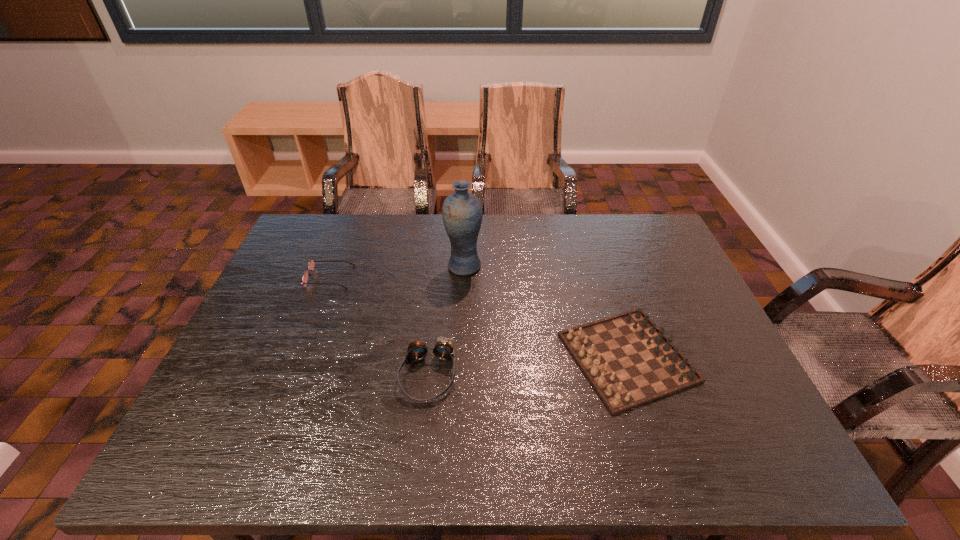
Image resolution: width=960 pixels, height=540 pixels. In order to click on object situated at the left edge in this screenshot , I will do `click(311, 264)`.

The image size is (960, 540). Find the location of `object situated at the right edge`. object situated at the right edge is located at coordinates (629, 361).

The width and height of the screenshot is (960, 540). I want to click on vacant space at the far edge, so click(403, 234).

At what (x,y) coordinates should I click in order to perform the action: click on vacant space at the near edge of the desktop. Please return your answer as a coordinate pair (x, y). Looking at the image, I should click on (409, 453).

Locate an element on the screen. vacant space at the left edge of the desktop is located at coordinates (276, 312).

Where is `blank space at the right edge of the desktop`? Image resolution: width=960 pixels, height=540 pixels. blank space at the right edge of the desktop is located at coordinates coord(676,269).

Locate an element on the screen. Image resolution: width=960 pixels, height=540 pixels. free spot at the near left corner of the desktop is located at coordinates (206, 434).

The width and height of the screenshot is (960, 540). In order to click on vacant space at the near right corner of the desktop in this screenshot , I will do `click(780, 448)`.

This screenshot has width=960, height=540. In order to click on free spot between the leftmost object and the goggles in this screenshot , I will do `click(378, 326)`.

The width and height of the screenshot is (960, 540). What are the coordinates of `free point between the rightmost object and the leftmost object` in the screenshot? It's located at (478, 317).